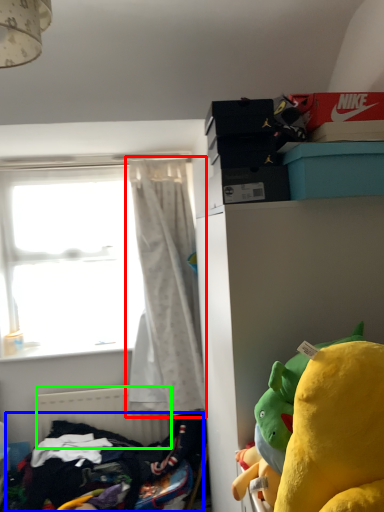
Question: Which object is the closest to the curtain (highlighted by a red box)? Choose among these: clothing (highlighted by a blue box) or radiator (highlighted by a green box).

Choices:
 (A) clothing
 (B) radiator

Answer: (B)